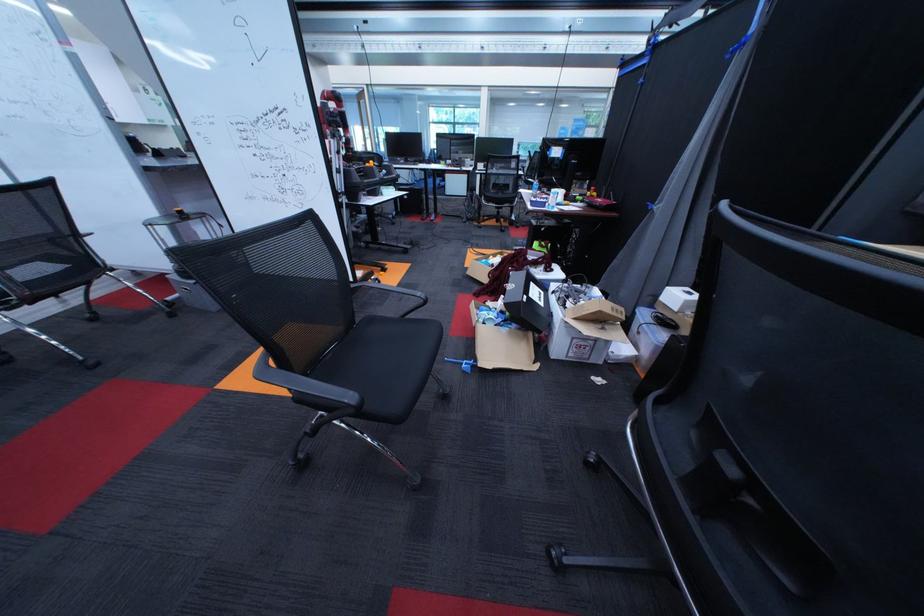
Image resolution: width=924 pixels, height=616 pixels. I want to click on white box, so click(x=580, y=334).